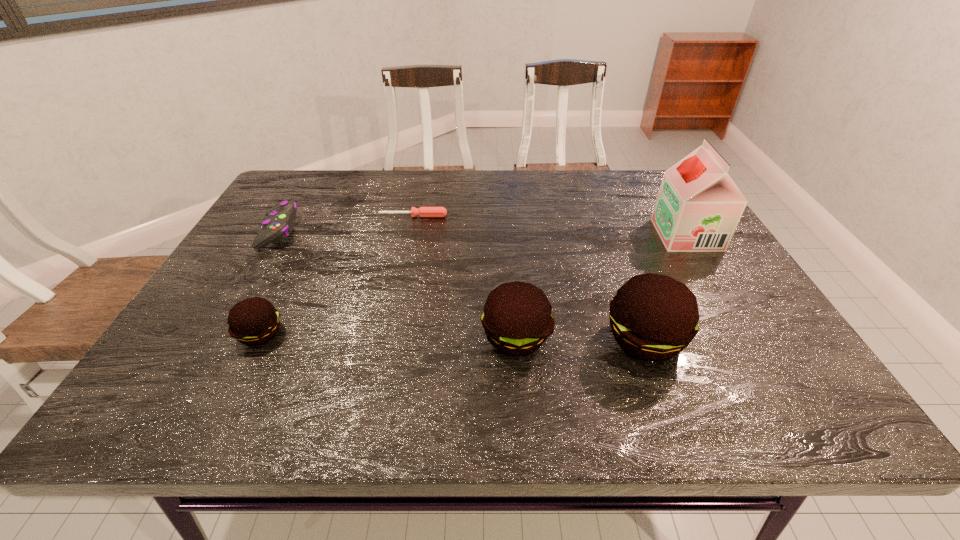
This screenshot has width=960, height=540. I want to click on location for an additional patty_(food) to make spacing equal, so click(388, 335).